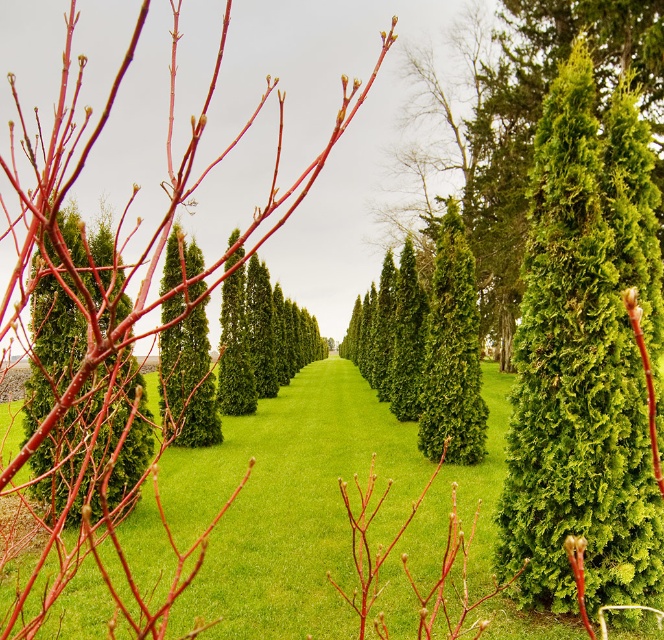
You are standing at the entrance of the garden and see two points marked on the pathway. The first point is at coordinate point (83, 264) and the second is at point (175, 404). Which point is nearer to you?

Point (83, 264) is closer to the viewer than point (175, 404).

You are standing at the starting point of the garden pathway and want to reach the green fuzzy shrub at right located at point (584, 356). Which direction should you move to reach it?

To reach the green fuzzy shrub at right located at point (584, 356), you should move towards the right side of the pathway since the shrub is positioned at the right.

You are a landscape designer planning to replace the green fuzzy shrub at right and the matte red shrub at left with new plants. If you want to maintain the current visual balance between the two shrubs, which shrub should you choose a thicker replacement for?

The green fuzzy shrub at right is thinner than the matte red shrub at left, so to maintain visual balance, you should choose a thicker replacement for the green fuzzy shrub at right.